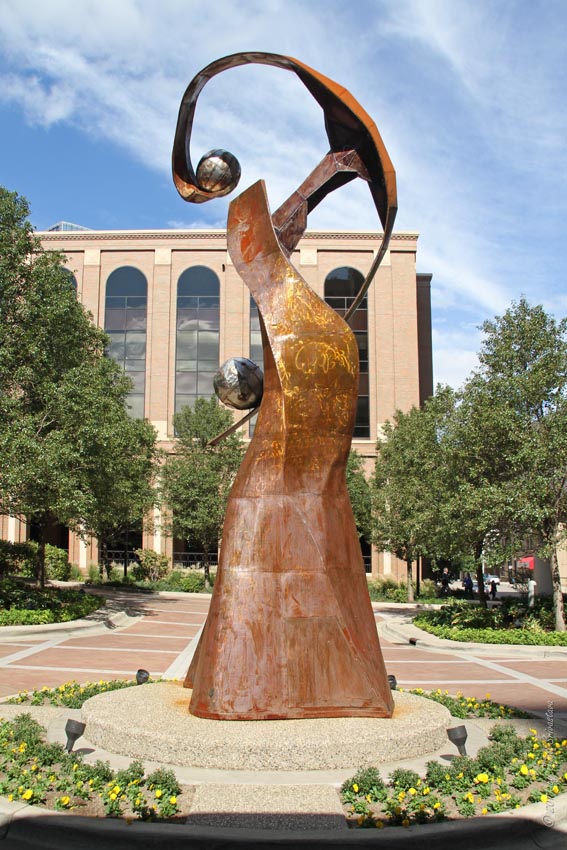
Locate an element on the screen. glass window is located at coordinates (204, 358).